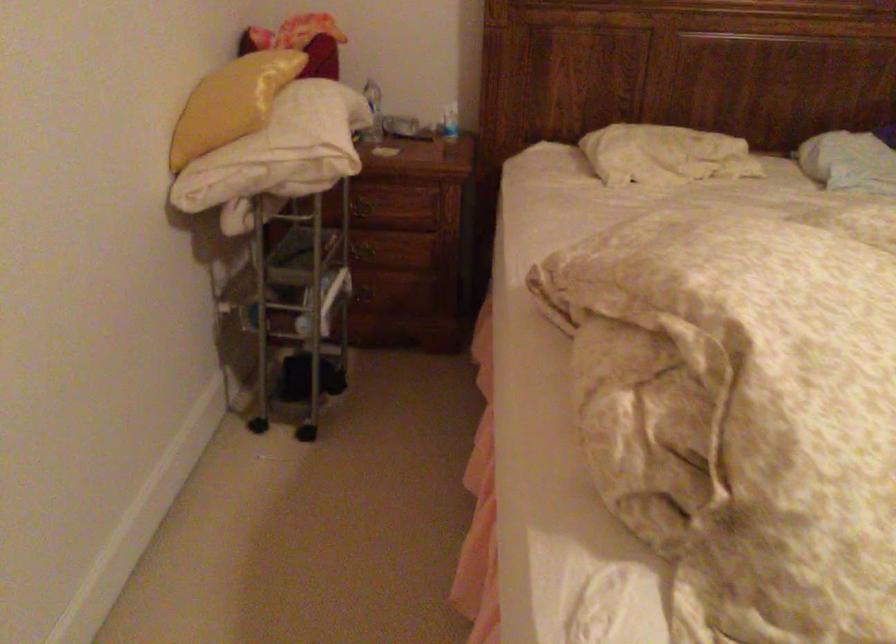
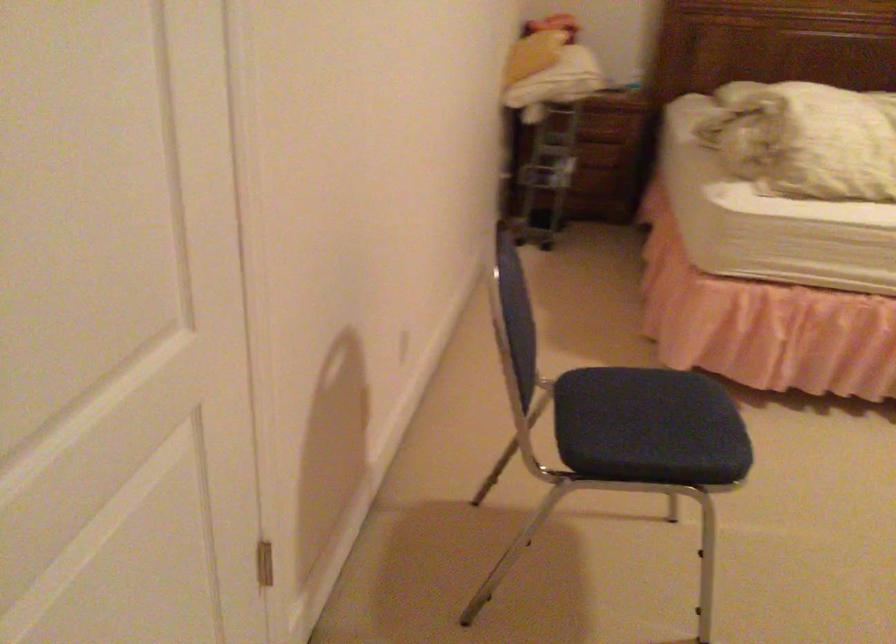
Question: In a continuous first-person perspective shot, in which direction is the camera moving?

Choices:
 (A) Left
 (B) Right
 (C) Forward
 (D) Backward

Answer: (D)